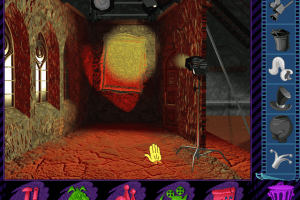
Locate an element on the screen. This screenshot has width=300, height=200. windows is located at coordinates click(9, 85), click(42, 84).